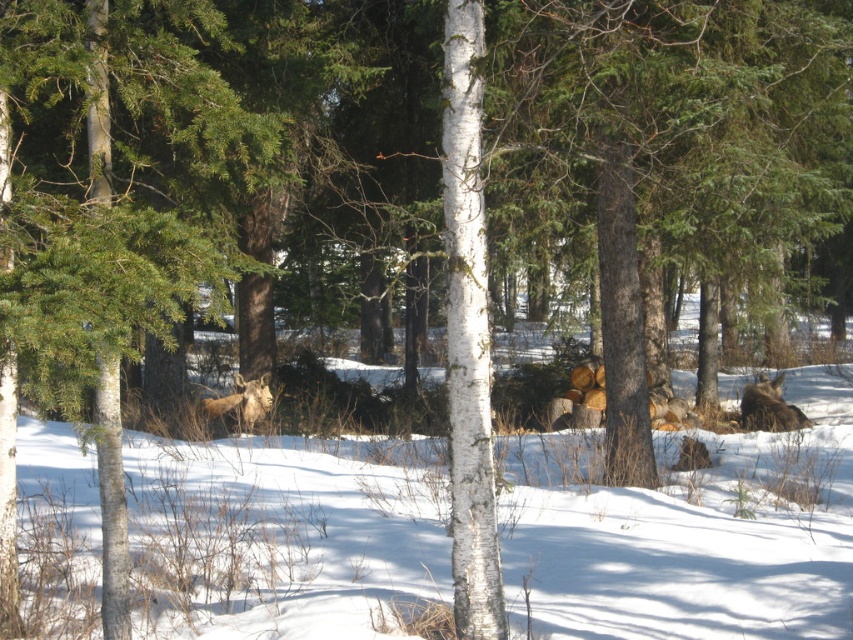
Question: Can you confirm if brown fur animal at lower right is positioned to the right of brown fur deer at center?

Choices:
 (A) no
 (B) yes

Answer: (B)

Question: Can you confirm if brown fur animal at lower right is positioned above brown fur deer at center?

Choices:
 (A) no
 (B) yes

Answer: (A)

Question: Which is nearer to the brown fur deer at center?

Choices:
 (A) white smooth birch tree at center
 (B) brown fur animal at lower right
 (C) green matte tree at left

Answer: (B)

Question: Can you confirm if green matte tree at left is smaller than brown fur animal at lower right?

Choices:
 (A) yes
 (B) no

Answer: (B)

Question: Which of the following is the farthest from the observer?

Choices:
 (A) brown fur deer at center
 (B) brown fur animal at lower right
 (C) green matte tree at left

Answer: (B)

Question: Which point appears farthest from the camera in this image?

Choices:
 (A) (7, 404)
 (B) (492, 493)
 (C) (207, 416)

Answer: (C)